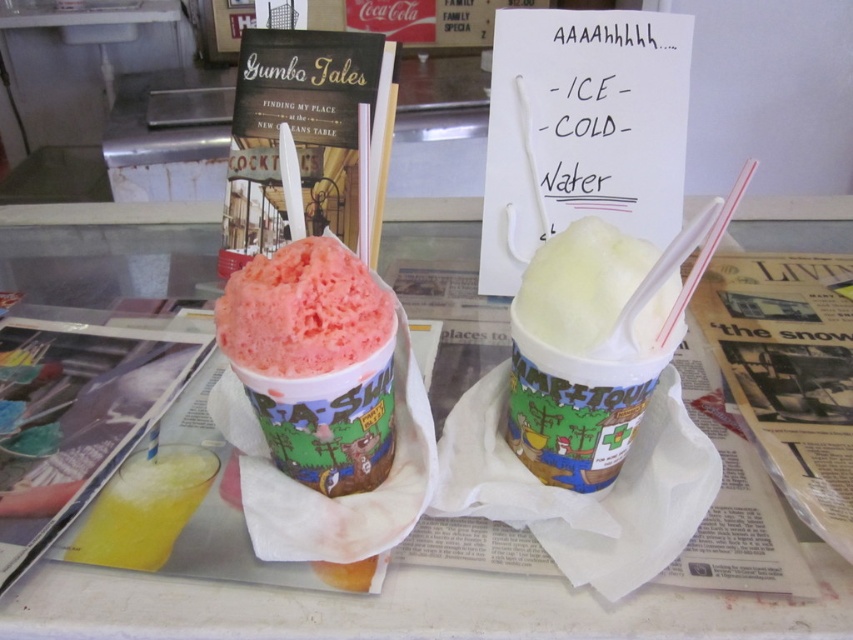
Question: Is matte pink shaved ice at center further to camera compared to white creamy milkshake at center?

Choices:
 (A) no
 (B) yes

Answer: (B)

Question: Is matte pink shaved ice at center positioned in front of white creamy milkshake at center?

Choices:
 (A) no
 (B) yes

Answer: (A)

Question: Which point is closer to the camera?

Choices:
 (A) (231, 323)
 (B) (509, 412)

Answer: (A)

Question: Does matte pink shaved ice at center appear on the right side of white creamy milkshake at center?

Choices:
 (A) yes
 (B) no

Answer: (B)